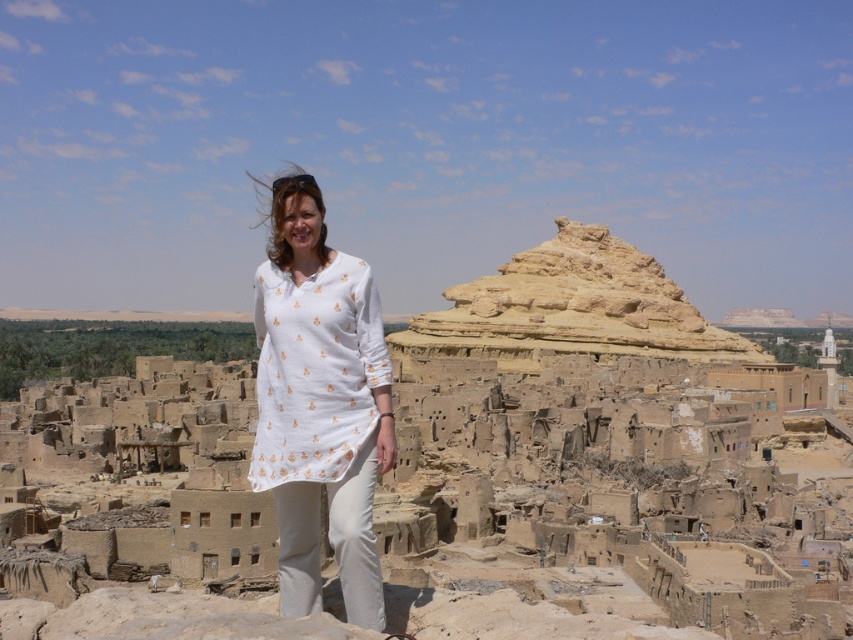
You are standing in the desert and see the white cotton dress at center and the earthy brown stone pyramid at center. Which object is positioned to the left from your perspective?

The white cotton dress at center is to the left of the earthy brown stone pyramid at center.

You are a photographer trying to capture the white cotton dress at center and the earthy brown stone pyramid at center in the same frame. Based on their heights, which one will appear larger in the photo?

The earthy brown stone pyramid at center will appear larger in the photo because it is taller than the white cotton dress at center.

You are a photographer planning to capture a photo of the white cotton dress at center and the earthy brown stone pyramid at center. Based on their sizes, which object would you focus on first to ensure it is clearly visible in the frame?

The earthy brown stone pyramid at center is larger than the white cotton dress at center, so focusing on it first would ensure it is clearly visible in the frame.